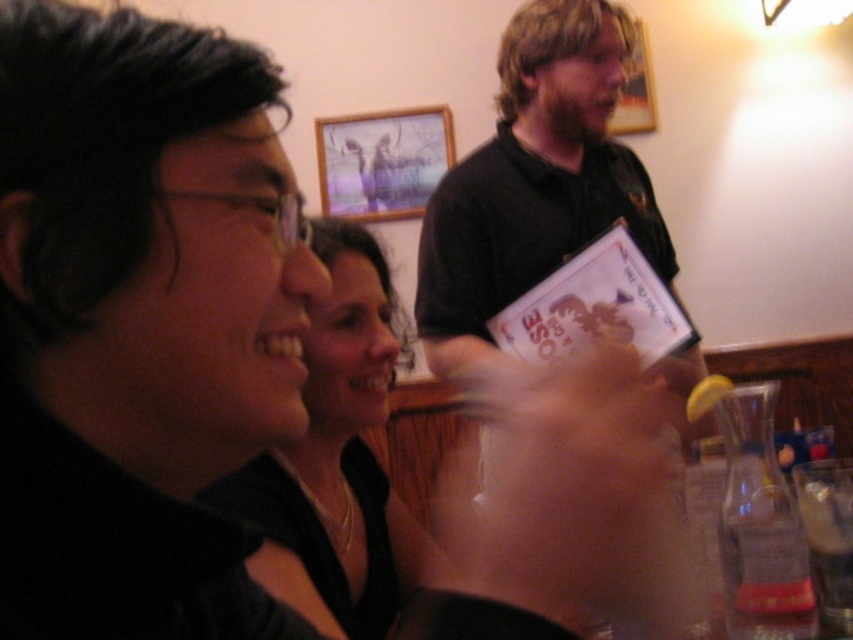
Question: Which object is positioned closest to the dark brown shirt at center?

Choices:
 (A) wooden picture frame at upper center
 (B) black matte face at center
 (C) white paper card at center

Answer: (C)

Question: Can you confirm if black matte face at center is smaller than clear glass at lower right?

Choices:
 (A) yes
 (B) no

Answer: (A)

Question: Is white paper card at center above wooden picture frame at upper center?

Choices:
 (A) yes
 (B) no

Answer: (B)

Question: Which of these objects is positioned farthest from the dark brown shirt at center?

Choices:
 (A) wooden picture frame at upper center
 (B) clear glass at lower right
 (C) smooth black shirt at center

Answer: (A)

Question: Can you confirm if black matte face at center is thinner than wooden picture frame at upper center?

Choices:
 (A) no
 (B) yes

Answer: (B)

Question: Which point is farther to the camera?

Choices:
 (A) wooden picture frame at upper center
 (B) dark brown shirt at center
 (C) smooth black shirt at center

Answer: (A)